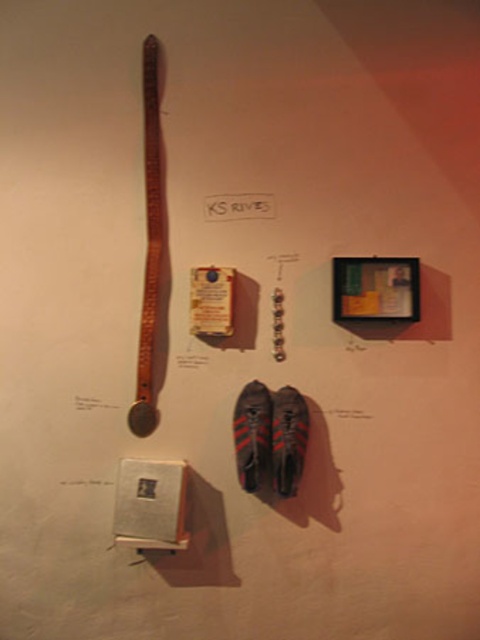
Does point (259, 438) come farther from viewer compared to point (300, 436)?

No.

At what (x,y) coordinates should I click in order to perform the action: click on reddish-brown leather shoe at center. Please return your answer as a coordinate pair (x, y). This screenshot has width=480, height=640. Looking at the image, I should click on (252, 435).